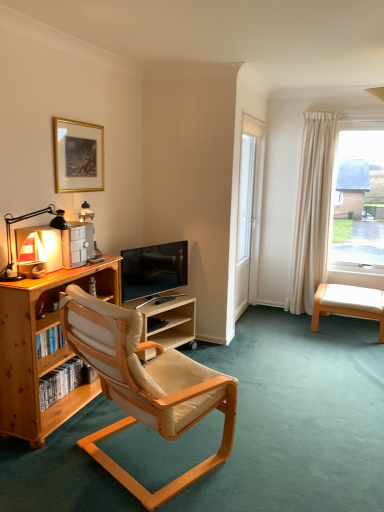
At what (x,y) coordinates should I click in order to perform the action: click on free space to the right of white glass screen door at center. Please return your answer as a coordinate pair (x, y). This screenshot has width=384, height=512. Looking at the image, I should click on (284, 320).